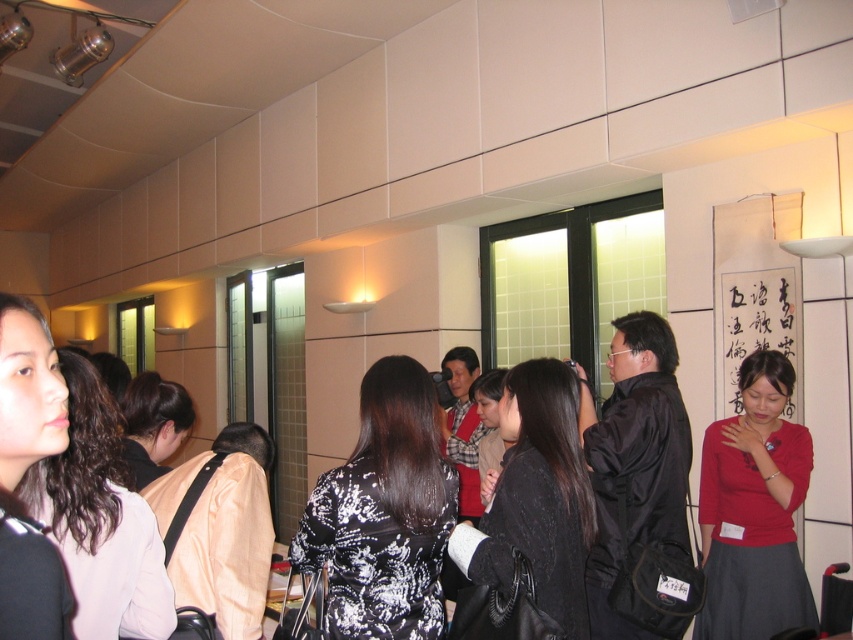
Which is more to the left, red matte dress at lower right or black matte hair at left?

black matte hair at left

Is point (747, 365) positioned behind point (6, 595)?

Yes, point (747, 365) is farther from viewer.

Is point (767, 490) behind point (67, 593)?

Yes, it is behind point (67, 593).

In order to click on red matte dress at lower right in this screenshot , I will do `click(753, 509)`.

Is point (306, 525) positioned after point (142, 605)?

That is True.

Is black printed dress at center below light pink fabric at center?

Yes.

Where is `black printed dress at center`? black printed dress at center is located at coordinates (384, 513).

Which is more to the right, black printed dress at center or black textured sweater at center?

Positioned to the right is black textured sweater at center.

Does black printed dress at center have a lesser width compared to black textured sweater at center?

No.

In order to click on black printed dress at center in this screenshot , I will do `click(384, 513)`.